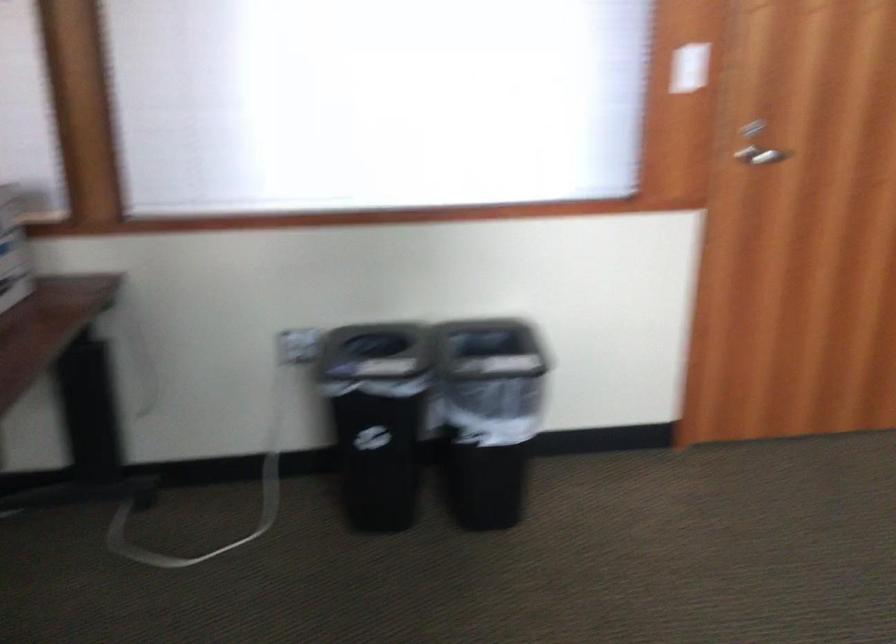
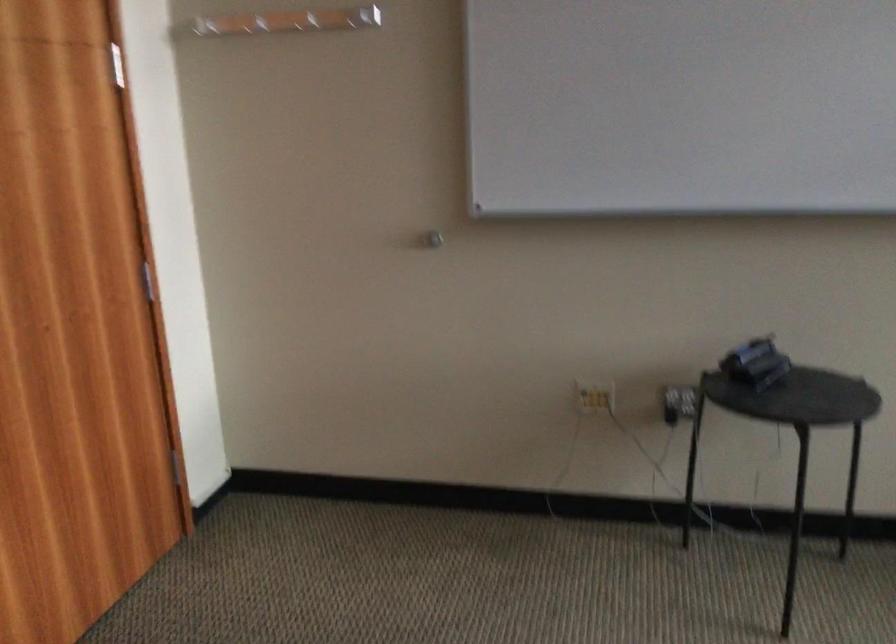
Question: The first image is from the beginning of the video and the second image is from the end. How did the camera likely rotate when shooting the video?

Choices:
 (A) Left
 (B) Right
 (C) Up
 (D) Down

Answer: (B)